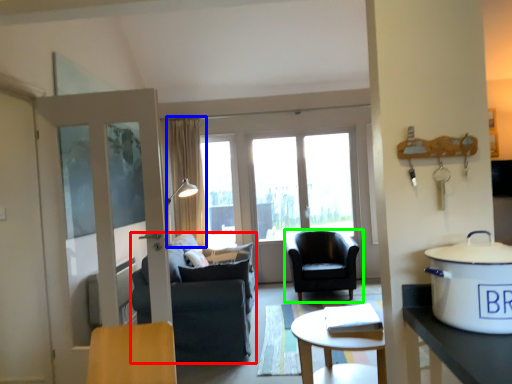
Question: Based on their relative distances, which object is nearer to chair (highlighted by a red box)? Choose from curtain (highlighted by a blue box) and chair (highlighted by a green box).

Choices:
 (A) curtain
 (B) chair

Answer: (B)